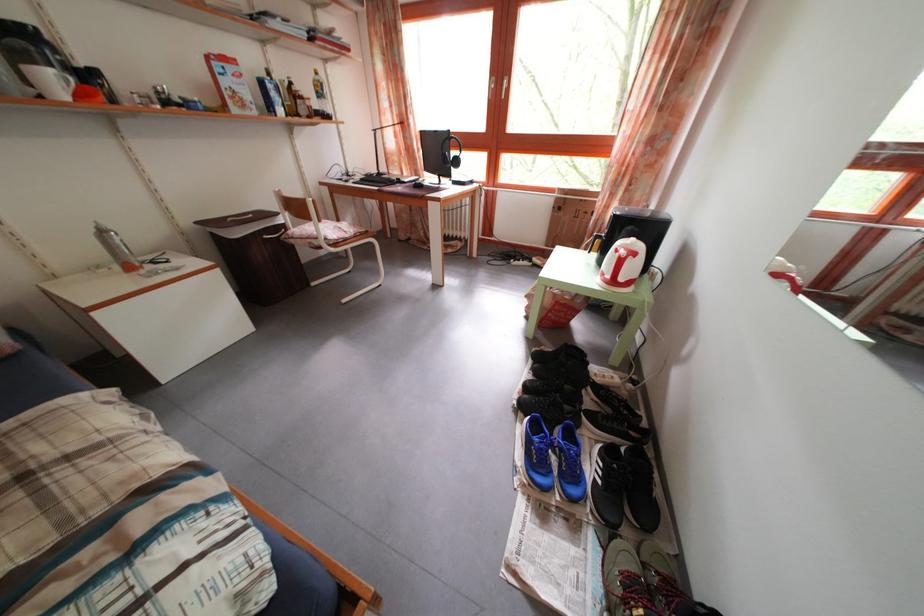
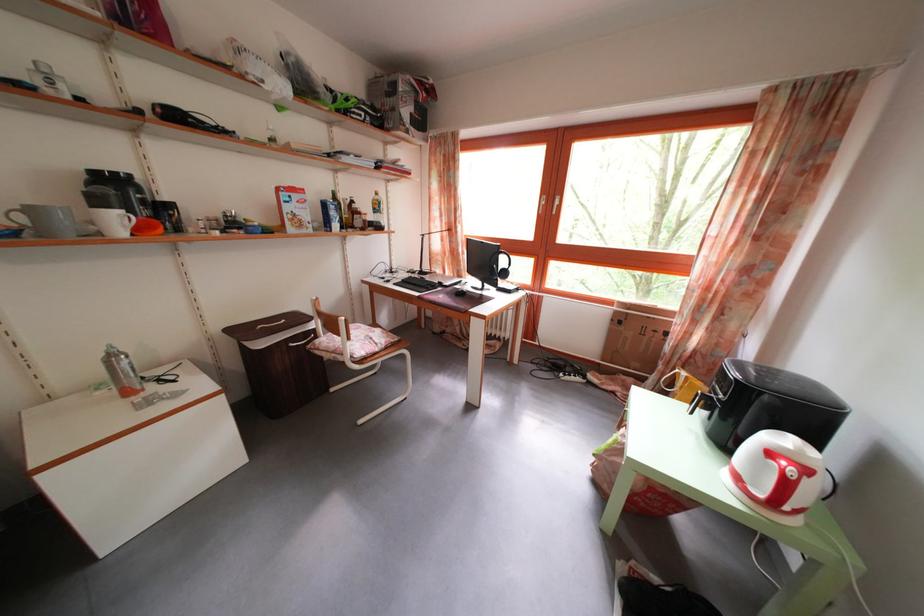
Find the pixel in the second image that matches the point at 446,160 in the first image.

(492, 265)